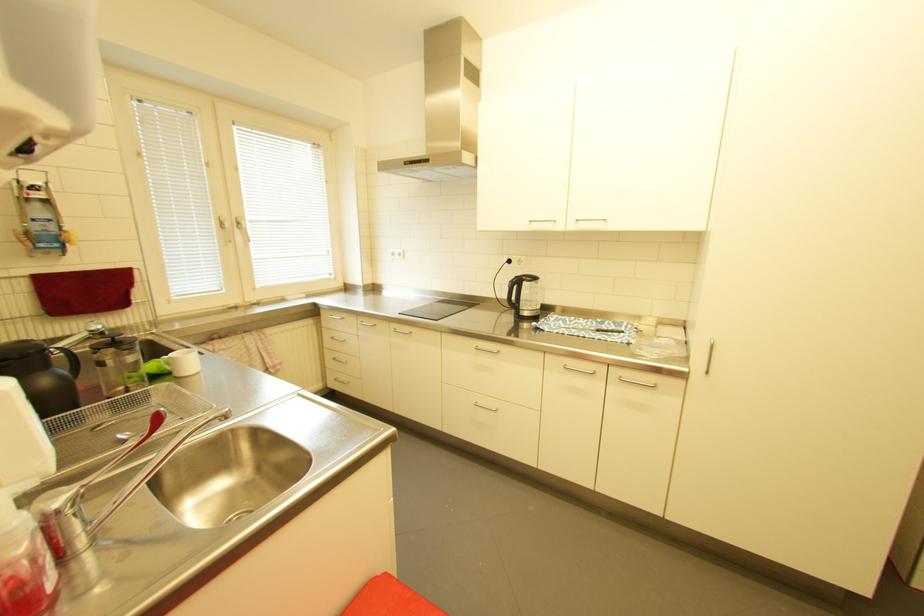
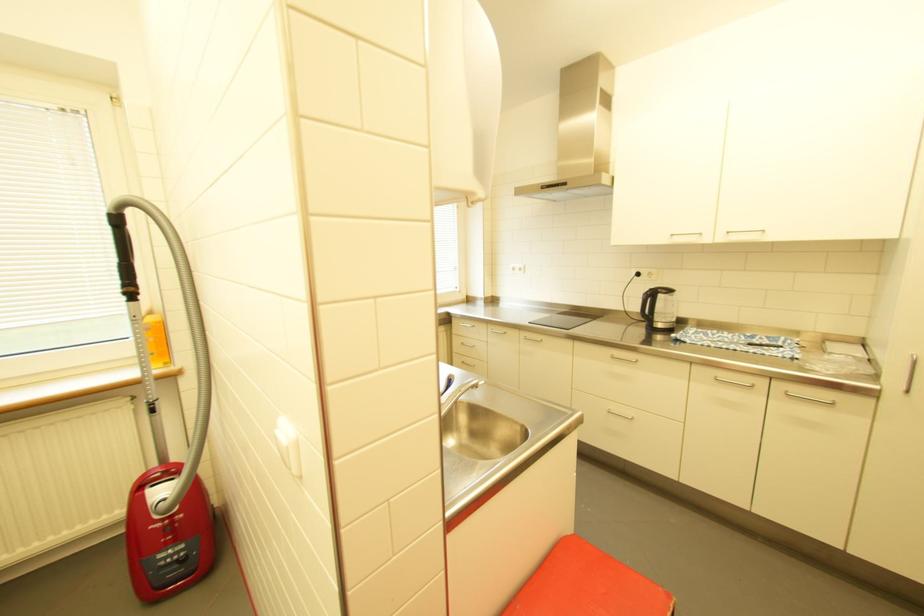
Find the pixel in the second image that matches point 517,282 in the first image.

(651, 294)